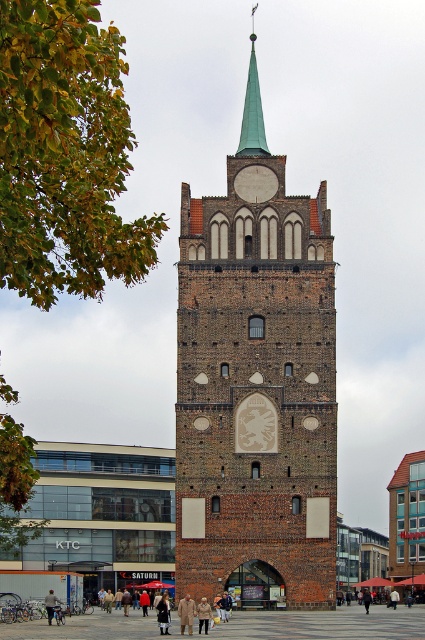
Who is shorter, green polished metal spire at upper center or khaki cotton pants at center?

With less height is khaki cotton pants at center.

You are a GUI agent. You are given a task and a screenshot of the screen. Output one action in this format:
    pyautogui.click(x=<x>, y=<y>)
    Task: Click on the green polished metal spire at upper center
    
    Given the screenshot: What is the action you would take?
    pyautogui.click(x=252, y=109)

Where is `green polished metal spire at upper center`? The image size is (425, 640). green polished metal spire at upper center is located at coordinates (252, 109).

Does point (23, 627) lie behind point (206, 602)?

Yes, it is behind point (206, 602).

Is point (57, 556) more distant than point (201, 611)?

Yes, point (57, 556) is farther from viewer.

You are a GUI agent. You are given a task and a screenshot of the screen. Output one action in this format:
    pyautogui.click(x=<x>, y=<y>)
    Task: Click on the brick pavement at center
    The height and width of the screenshot is (640, 425).
    Given the screenshot: What is the action you would take?
    pyautogui.click(x=325, y=624)

Between point (184, 557) and point (249, 38), which one is positioned behind?

Point (249, 38)

Between brown brick tower at center and green polished metal spire at upper center, which one has less height?

green polished metal spire at upper center

What do you see at coordinates (255, 387) in the screenshot? I see `brown brick tower at center` at bounding box center [255, 387].

The image size is (425, 640). In order to click on brown brick tower at center in this screenshot , I will do `click(255, 387)`.